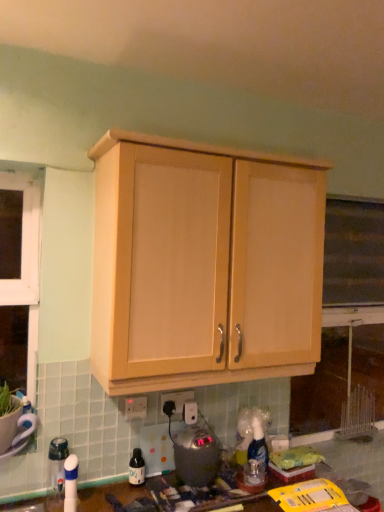
Question: Considering the relative sizes of satin silver appliance at lower center and translucent plastic bottle at lower center in the image provided, is satin silver appliance at lower center bigger than translucent plastic bottle at lower center?

Choices:
 (A) no
 (B) yes

Answer: (B)

Question: Considering the relative sizes of satin silver appliance at lower center and translucent plastic bottle at lower center in the image provided, is satin silver appliance at lower center thinner than translucent plastic bottle at lower center?

Choices:
 (A) no
 (B) yes

Answer: (A)

Question: From the image's perspective, would you say satin silver appliance at lower center is shown under translucent plastic bottle at lower center?

Choices:
 (A) no
 (B) yes

Answer: (A)

Question: From a real-world perspective, is satin silver appliance at lower center over translucent plastic bottle at lower center?

Choices:
 (A) no
 (B) yes

Answer: (B)

Question: Does satin silver appliance at lower center turn towards translucent plastic bottle at lower center?

Choices:
 (A) yes
 (B) no

Answer: (B)

Question: Can you confirm if satin silver appliance at lower center is taller than translucent plastic bottle at lower center?

Choices:
 (A) no
 (B) yes

Answer: (B)

Question: Is the depth of translucent plastic bottle at lower center greater than that of light wood cabinet at upper center?

Choices:
 (A) yes
 (B) no

Answer: (A)

Question: Does translucent plastic bottle at lower center appear on the right side of light wood cabinet at upper center?

Choices:
 (A) yes
 (B) no

Answer: (B)

Question: From the image's perspective, is translucent plastic bottle at lower center beneath light wood cabinet at upper center?

Choices:
 (A) no
 (B) yes

Answer: (B)

Question: From a real-world perspective, is translucent plastic bottle at lower center physically below light wood cabinet at upper center?

Choices:
 (A) no
 (B) yes

Answer: (B)

Question: Considering the relative sizes of translucent plastic bottle at lower center and light wood cabinet at upper center in the image provided, is translucent plastic bottle at lower center taller than light wood cabinet at upper center?

Choices:
 (A) yes
 (B) no

Answer: (B)

Question: Is translucent plastic bottle at lower center looking in the opposite direction of light wood cabinet at upper center?

Choices:
 (A) no
 (B) yes

Answer: (A)

Question: Can you confirm if white plastic electric outlet at center, the 1th electric outlet when ordered from right to left, is positioned to the right of white plastic electric outlet at lower center, arranged as the first electric outlet when viewed from the left?

Choices:
 (A) yes
 (B) no

Answer: (A)